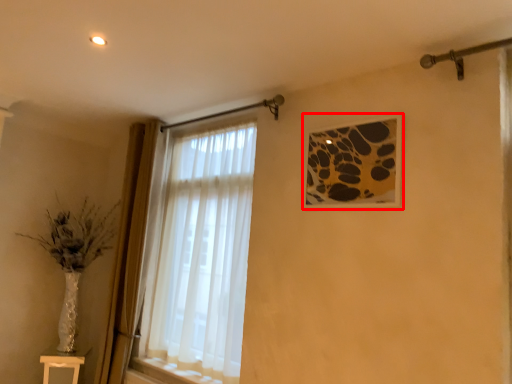
Question: From the image's perspective, considering the relative positions of picture frame (annotated by the red box) and table in the image provided, where is picture frame (annotated by the red box) located with respect to the staircase?

Choices:
 (A) below
 (B) above

Answer: (B)